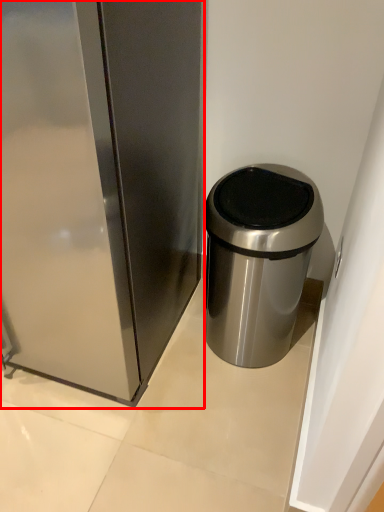
Question: From the image's perspective, where is appliance (annotated by the red box) located relative to waste container?

Choices:
 (A) above
 (B) below

Answer: (A)